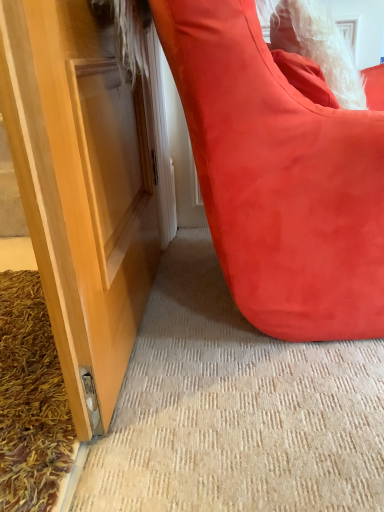
Describe the element at coordinates (235, 409) in the screenshot. I see `shaggy brown doormat at lower left` at that location.

I want to click on shaggy brown doormat at lower left, so click(235, 409).

Locate an element on the screen. The image size is (384, 512). suede-like red bean bag at lower right is located at coordinates (279, 177).

The width and height of the screenshot is (384, 512). What do you see at coordinates (279, 177) in the screenshot?
I see `suede-like red bean bag at lower right` at bounding box center [279, 177].

Find the location of a particular element. shaggy brown doormat at lower left is located at coordinates (235, 409).

Considering the positions of objects suede-like red bean bag at lower right and shaggy brown doormat at lower left in the image provided, who is more to the left, suede-like red bean bag at lower right or shaggy brown doormat at lower left?

Positioned to the left is shaggy brown doormat at lower left.

Which object is closer to the camera taking this photo, suede-like red bean bag at lower right or shaggy brown doormat at lower left?

suede-like red bean bag at lower right.

Is point (257, 298) closer or farther from the camera than point (382, 351)?

Clearly, point (257, 298) is closer to the camera than point (382, 351).

From the image's perspective, would you say suede-like red bean bag at lower right is positioned over shaggy brown doormat at lower left?

Correct, suede-like red bean bag at lower right appears higher than shaggy brown doormat at lower left in the image.

From a real-world perspective, does suede-like red bean bag at lower right stand above shaggy brown doormat at lower left?

Yes.

Which of these two, suede-like red bean bag at lower right or shaggy brown doormat at lower left, is thinner?

suede-like red bean bag at lower right is thinner.

Considering the relative sizes of suede-like red bean bag at lower right and shaggy brown doormat at lower left in the image provided, is suede-like red bean bag at lower right shorter than shaggy brown doormat at lower left?

In fact, suede-like red bean bag at lower right may be taller than shaggy brown doormat at lower left.

Is suede-like red bean bag at lower right smaller than shaggy brown doormat at lower left?

Actually, suede-like red bean bag at lower right might be larger than shaggy brown doormat at lower left.

Could shaggy brown doormat at lower left be considered to be inside suede-like red bean bag at lower right?

Actually, shaggy brown doormat at lower left is outside suede-like red bean bag at lower right.

Is suede-like red bean bag at lower right positioned far away from shaggy brown doormat at lower left?

No, suede-like red bean bag at lower right is not far from shaggy brown doormat at lower left.

Is suede-like red bean bag at lower right oriented away from shaggy brown doormat at lower left?

No, suede-like red bean bag at lower right is not facing the opposite direction of shaggy brown doormat at lower left.

Measure the distance between suede-like red bean bag at lower right and shaggy brown doormat at lower left.

They are 11.06 inches apart.

Locate an element on the screen. furniture above the shaggy brown doormat at lower left (from a real-world perspective) is located at coordinates (279, 177).

Is shaggy brown doormat at lower left to the right of suede-like red bean bag at lower right from the viewer's perspective?

No, shaggy brown doormat at lower left is not to the right of suede-like red bean bag at lower right.

Is the depth of shaggy brown doormat at lower left less than that of suede-like red bean bag at lower right?

No.

Is point (324, 485) less distant than point (260, 95)?

That is False.

From the image's perspective, does shaggy brown doormat at lower left appear higher than suede-like red bean bag at lower right?

Actually, shaggy brown doormat at lower left appears below suede-like red bean bag at lower right in the image.

From a real-world perspective, which object stands above the other?

In real-world perspective, suede-like red bean bag at lower right is above.

Can you confirm if shaggy brown doormat at lower left is thinner than suede-like red bean bag at lower right?

In fact, shaggy brown doormat at lower left might be wider than suede-like red bean bag at lower right.

Considering the sizes of objects shaggy brown doormat at lower left and suede-like red bean bag at lower right in the image provided, who is shorter, shaggy brown doormat at lower left or suede-like red bean bag at lower right?

Standing shorter between the two is shaggy brown doormat at lower left.

Based on their sizes in the image, would you say shaggy brown doormat at lower left is bigger or smaller than suede-like red bean bag at lower right?

Considering their sizes, shaggy brown doormat at lower left takes up less space than suede-like red bean bag at lower right.

Can we say shaggy brown doormat at lower left lies outside suede-like red bean bag at lower right?

Yes, shaggy brown doormat at lower left is not within suede-like red bean bag at lower right.

Is shaggy brown doormat at lower left far away from suede-like red bean bag at lower right?

No.

Is shaggy brown doormat at lower left looking in the opposite direction of suede-like red bean bag at lower right?

shaggy brown doormat at lower left does not have its back to suede-like red bean bag at lower right.

How different are the orientations of shaggy brown doormat at lower left and suede-like red bean bag at lower right in degrees?

shaggy brown doormat at lower left and suede-like red bean bag at lower right are facing 176 degrees away from each other.

From the picture: Measure the distance from shaggy brown doormat at lower left to suede-like red bean bag at lower right.

The distance of shaggy brown doormat at lower left from suede-like red bean bag at lower right is 11.06 inches.

The height and width of the screenshot is (512, 384). I want to click on furniture to the right of shaggy brown doormat at lower left, so [279, 177].

At what (x,y) coordinates should I click in order to perform the action: click on furniture positioned vertically above the shaggy brown doormat at lower left (from a real-world perspective). Please return your answer as a coordinate pair (x, y). The height and width of the screenshot is (512, 384). Looking at the image, I should click on (279, 177).

Where is `furniture in front of the shaggy brown doormat at lower left`? Image resolution: width=384 pixels, height=512 pixels. furniture in front of the shaggy brown doormat at lower left is located at coordinates (279, 177).